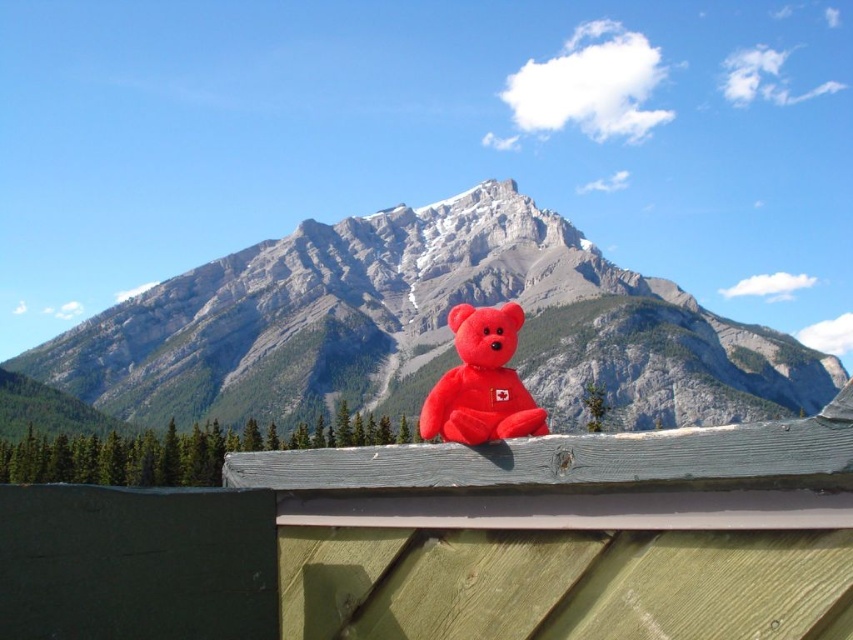
You are a photographer trying to capture the matte red teddy bear at center and the matte plush bear at center in a single shot. Based on their positions, which bear is closer to the camera?

The matte red teddy bear at center is positioned over the matte plush bear at center, so it is closer to the camera.

You are an observer looking at the wooden surface where both the matte red teddy bear at center and the matte plush bear at center are placed. Which bear is closer to the left edge of the wooden surface?

The matte red teddy bear at center is positioned on the left side of the matte plush bear at center, so it is closer to the left edge of the wooden surface.